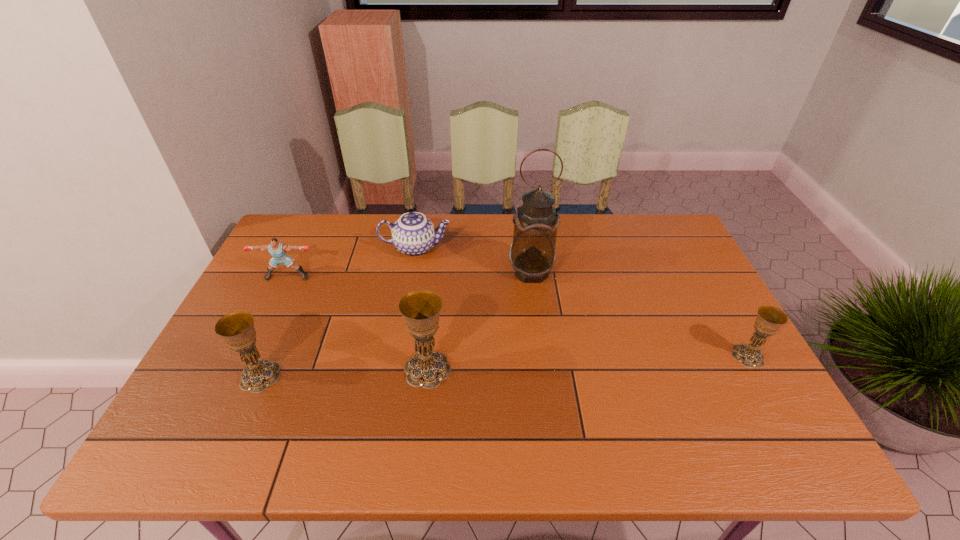
Point out which chalice is positioned as the nearest to the tallest object. Please provide its 2D coordinates. Your answer should be formatted as a tuple, i.e. [(x, y)], where the tuple contains the x and y coordinates of a point satisfying the conditions above.

[(420, 309)]

The image size is (960, 540). In order to click on free region that satisfies the following two spatial constraints: 1. from the spout of the chinaware; 2. on the right side of the shortest chalice in this screenshot , I will do tap(396, 356).

Locate an element on the screen. The image size is (960, 540). vacant space that satisfies the following two spatial constraints: 1. from the spout of the second tallest object; 2. on the left side of the chinaware is located at coordinates (395, 369).

You are a GUI agent. You are given a task and a screenshot of the screen. Output one action in this format:
    pyautogui.click(x=<x>, y=<y>)
    Task: Click on the free spot that satisfies the following two spatial constraints: 1. from the spout of the chinaware; 2. on the right side of the second chalice from left to right
    
    Given the screenshot: What is the action you would take?
    pyautogui.click(x=395, y=369)

Locate an element on the screen. The width and height of the screenshot is (960, 540). vacant space that satisfies the following two spatial constraints: 1. on the front-facing side of the rightmost chalice; 2. on the right side of the puncher is located at coordinates (249, 356).

Where is `vacant space that satisfies the following two spatial constraints: 1. on the front-facing side of the puncher; 2. on the right side of the rightmost object`? vacant space that satisfies the following two spatial constraints: 1. on the front-facing side of the puncher; 2. on the right side of the rightmost object is located at coordinates (249, 356).

The width and height of the screenshot is (960, 540). Identify the location of blank space that satisfies the following two spatial constraints: 1. on the back side of the tallest chalice; 2. from the spout of the chinaware. (441, 248).

Where is `vacant region that satisfies the following two spatial constraints: 1. on the front-facing side of the puncher; 2. on the left side of the tallest chalice`? The width and height of the screenshot is (960, 540). vacant region that satisfies the following two spatial constraints: 1. on the front-facing side of the puncher; 2. on the left side of the tallest chalice is located at coordinates (243, 369).

You are a GUI agent. You are given a task and a screenshot of the screen. Output one action in this format:
    pyautogui.click(x=<x>, y=<y>)
    Task: Click on the vacant area that satisfies the following two spatial constraints: 1. on the back side of the leftmost chalice; 2. on the left side of the rightmost object
    
    Given the screenshot: What is the action you would take?
    pyautogui.click(x=270, y=356)